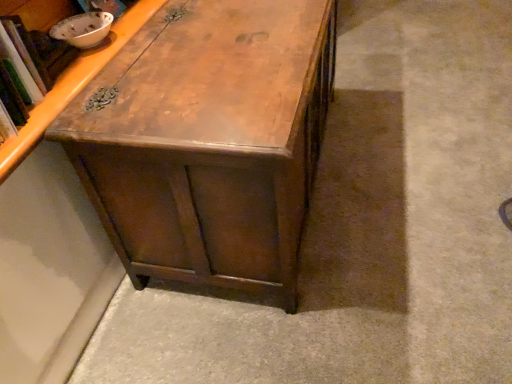
What are the coordinates of `wooden cabinet at upper left` in the screenshot? It's located at (73, 85).

The width and height of the screenshot is (512, 384). Describe the element at coordinates (73, 85) in the screenshot. I see `wooden cabinet at upper left` at that location.

Measure the distance between point (218, 173) and camera.

31.73 inches.

What do you see at coordinates (208, 140) in the screenshot? I see `wooden chest at center` at bounding box center [208, 140].

At what (x,y) coordinates should I click in order to perform the action: click on wooden chest at center. Please return your answer as a coordinate pair (x, y). The height and width of the screenshot is (384, 512). Looking at the image, I should click on (208, 140).

This screenshot has width=512, height=384. In order to click on wooden cabinet at upper left in this screenshot , I will do `click(73, 85)`.

Considering the relative positions of wooden cabinet at upper left and wooden chest at center in the image provided, is wooden cabinet at upper left to the left or to the right of wooden chest at center?

Clearly, wooden cabinet at upper left is on the left of wooden chest at center in the image.

Which object is more forward, wooden cabinet at upper left or wooden chest at center?

wooden cabinet at upper left is more forward.

Is point (133, 35) closer or farther from the camera than point (221, 89)?

Point (133, 35) appears to be farther away from the viewer than point (221, 89).

From the image's perspective, is wooden cabinet at upper left located beneath wooden chest at center?

Yes, from the image's perspective, wooden cabinet at upper left is below wooden chest at center.

From a real-world perspective, is wooden cabinet at upper left located beneath wooden chest at center?

Incorrect, from a real-world perspective, wooden cabinet at upper left is higher than wooden chest at center.

Does wooden cabinet at upper left have a greater width compared to wooden chest at center?

Incorrect, the width of wooden cabinet at upper left does not surpass that of wooden chest at center.

Looking at this image, which of these two, wooden cabinet at upper left or wooden chest at center, stands shorter?

wooden cabinet at upper left.

Considering the sizes of objects wooden cabinet at upper left and wooden chest at center in the image provided, who is bigger, wooden cabinet at upper left or wooden chest at center?

wooden chest at center is bigger.

Is wooden chest at center located within wooden cabinet at upper left?

That's incorrect, wooden chest at center is not inside wooden cabinet at upper left.

Is there a large distance between wooden cabinet at upper left and wooden chest at center?

wooden cabinet at upper left is near wooden chest at center, not far away.

Is wooden cabinet at upper left facing away from wooden chest at center?

No, wooden cabinet at upper left is not facing away from wooden chest at center.

What's the angular difference between wooden cabinet at upper left and wooden chest at center's facing directions?

The angular difference between wooden cabinet at upper left and wooden chest at center is 0.00137 degrees.

Measure the distance between wooden cabinet at upper left and wooden chest at center.

wooden cabinet at upper left and wooden chest at center are 11.31 inches apart from each other.

Find the location of `table above the wooden cabinet at upper left (from the image's perspective)`. table above the wooden cabinet at upper left (from the image's perspective) is located at coordinates click(208, 140).

Which object is positioned more to the left, wooden chest at center or wooden cabinet at upper left?

wooden cabinet at upper left is more to the left.

Is wooden chest at center closer to the viewer compared to wooden cabinet at upper left?

No, it is not.

Considering the positions of points (327, 54) and (17, 138), is point (327, 54) closer to camera compared to point (17, 138)?

That is False.

From the image's perspective, which one is positioned lower, wooden chest at center or wooden cabinet at upper left?

wooden cabinet at upper left is shown below in the image.

From a real-world perspective, is wooden chest at center located higher than wooden cabinet at upper left?

No, from a real-world perspective, wooden chest at center is not on top of wooden cabinet at upper left.

Considering the relative sizes of wooden chest at center and wooden cabinet at upper left in the image provided, is wooden chest at center wider than wooden cabinet at upper left?

Indeed, wooden chest at center has a greater width compared to wooden cabinet at upper left.

Looking at this image, is wooden chest at center taller than wooden cabinet at upper left?

Yes, wooden chest at center is taller than wooden cabinet at upper left.

Who is bigger, wooden chest at center or wooden cabinet at upper left?

With larger size is wooden chest at center.

Choose the correct answer: Is wooden chest at center inside wooden cabinet at upper left or outside it?

wooden chest at center lies outside wooden cabinet at upper left.

Is wooden chest at center far from wooden cabinet at upper left?

No, wooden chest at center is in close proximity to wooden cabinet at upper left.

Is wooden chest at center aimed at wooden cabinet at upper left?

No, wooden chest at center is not turned towards wooden cabinet at upper left.

In the scene shown: How different are the orientations of wooden chest at center and wooden cabinet at upper left in degrees?

They differ by 0.00137 degrees in their facing directions.

Where is `cabinetry lying below the wooden chest at center (from the image's perspective)`? cabinetry lying below the wooden chest at center (from the image's perspective) is located at coordinates [73, 85].

Locate an element on the screen. table behind the wooden cabinet at upper left is located at coordinates (208, 140).

Identify the location of table to the right of wooden cabinet at upper left. (208, 140).